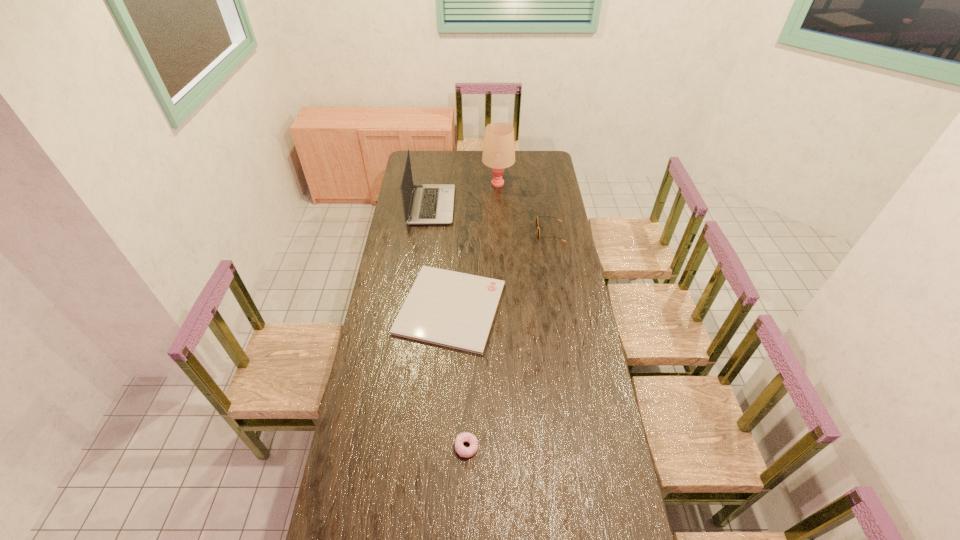
Identify the location of vacant space at the right edge of the desktop. The width and height of the screenshot is (960, 540). (556, 321).

Where is `free space at the far left corner`? Image resolution: width=960 pixels, height=540 pixels. free space at the far left corner is located at coordinates (424, 153).

This screenshot has width=960, height=540. What are the coordinates of `free spot at the far right corner of the desktop` in the screenshot? It's located at (530, 158).

This screenshot has width=960, height=540. Identify the location of free area in between the second nearest object and the lampshade. (474, 246).

You are a GUI agent. You are given a task and a screenshot of the screen. Output one action in this format:
    pyautogui.click(x=<x>, y=<y>)
    Task: Click on the empty location between the second tallest object and the sunglasses
    
    Given the screenshot: What is the action you would take?
    pyautogui.click(x=491, y=219)

At what (x,y) coordinates should I click in order to perform the action: click on vacant point located between the doughnut and the sunglasses. Please return your answer as a coordinate pair (x, y). Looking at the image, I should click on (509, 340).

This screenshot has width=960, height=540. In order to click on unoccupied area between the rightmost object and the laptop computer in this screenshot , I will do `click(491, 219)`.

At what (x,y) coordinates should I click in order to perform the action: click on free space between the rightmost object and the fourth shortest object. Please return your answer as a coordinate pair (x, y). The height and width of the screenshot is (540, 960). Looking at the image, I should click on (491, 219).

Identify the location of object that is the second closest to the tallest object. (537, 216).

Select which object is the fourth closest to the fourth farthest object. Please provide its 2D coordinates. Your answer should be formatted as a tuple, i.e. [(x, y)], where the tuple contains the x and y coordinates of a point satisfying the conditions above.

[(499, 149)]